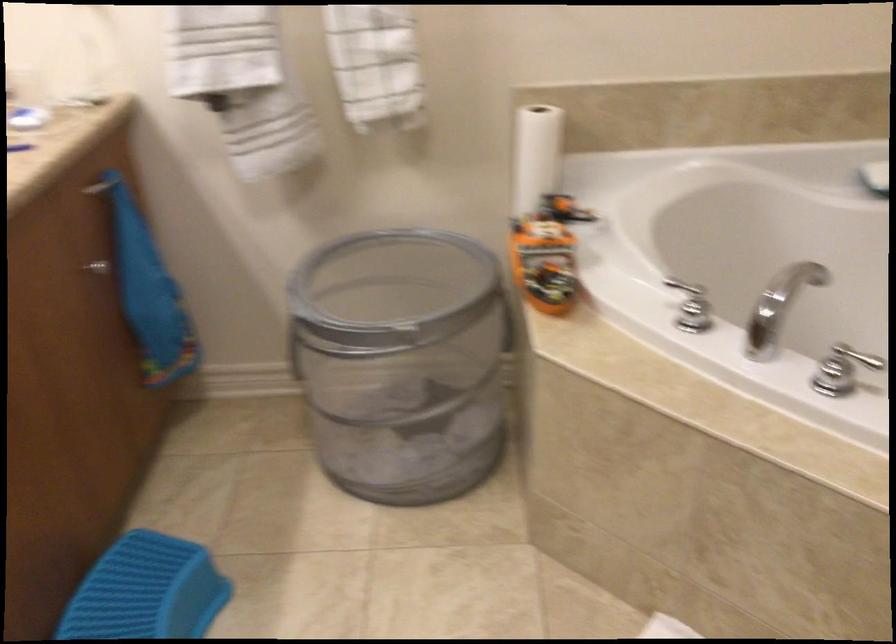
You are a GUI agent. You are given a task and a screenshot of the screen. Output one action in this format:
    pyautogui.click(x=<x>, y=<y>)
    Task: Click on the white paper towel roll
    
    Given the screenshot: What is the action you would take?
    pyautogui.click(x=536, y=156)